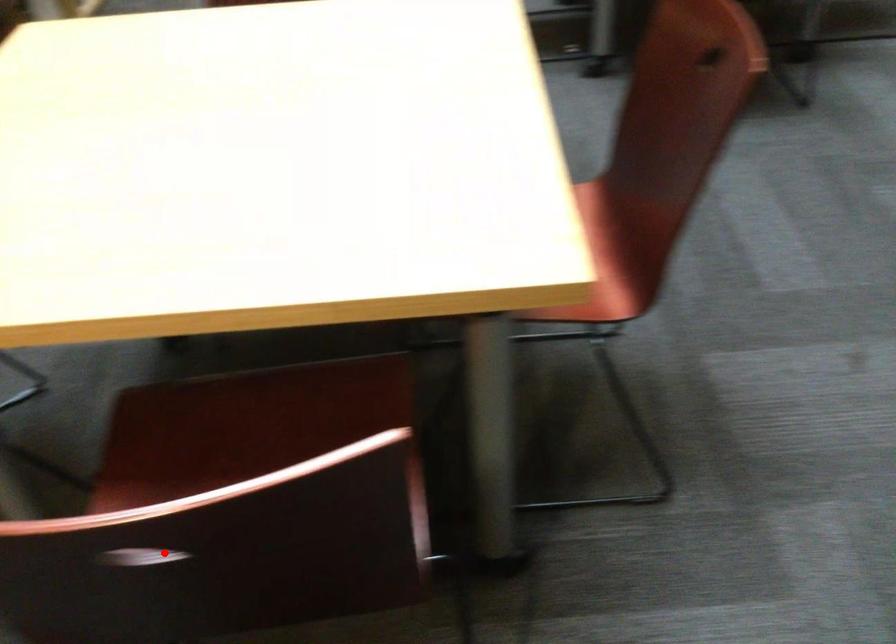
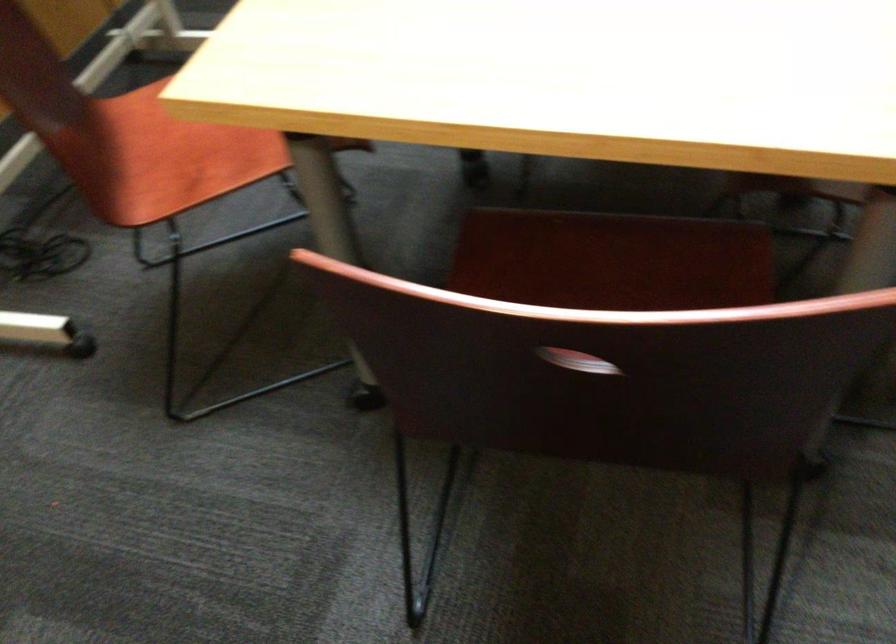
In the second image, find the point that corresponds to the highlighted location in the first image.

(576, 361)